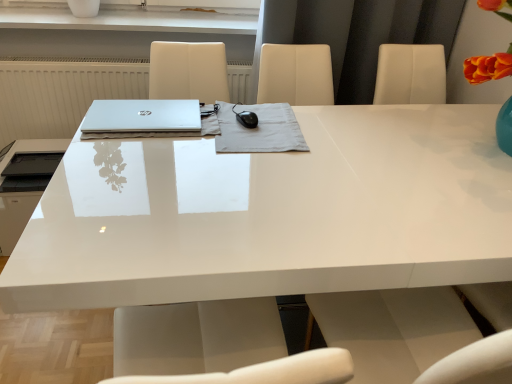
At what (x,y) coordinates should I click in order to perform the action: click on free space in front of satin black mouse at center. Please return your answer as a coordinate pair (x, y). Looking at the image, I should click on (251, 178).